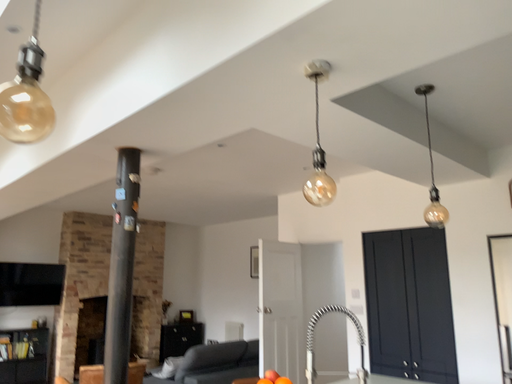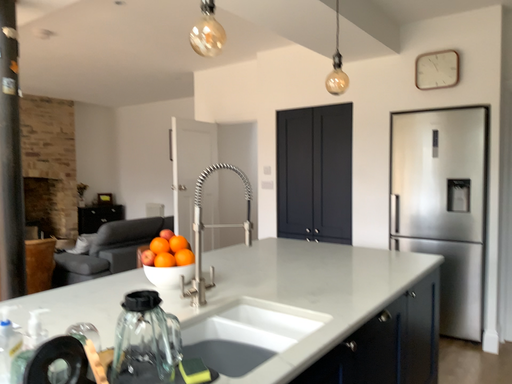
Question: Which way did the camera rotate in the video?

Choices:
 (A) rotated downward
 (B) rotated upward

Answer: (A)